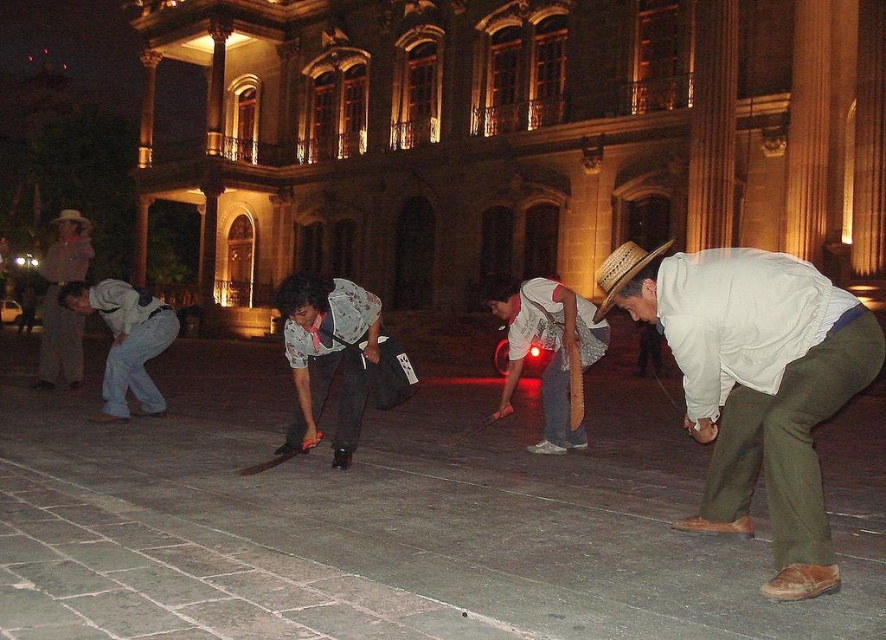
Question: Which of the following is the farthest from the observer?

Choices:
 (A) (88, 307)
 (B) (63, 273)
 (C) (743, 467)

Answer: (B)

Question: Which of the following is the closest to the observer?

Choices:
 (A) (690, 282)
 (B) (118, 305)
 (C) (80, 332)

Answer: (A)

Question: In this image, where is white cotton shirt at lower right located relative to light gray cotton shirt at left?

Choices:
 (A) below
 (B) above

Answer: (A)

Question: Can you confirm if light gray fabric shirt at left is positioned to the left of light gray cotton shirt at left?

Choices:
 (A) no
 (B) yes

Answer: (A)

Question: Among these points, which one is nearest to the camera?

Choices:
 (A) (775, 374)
 (B) (79, 282)
 (C) (57, 246)

Answer: (A)

Question: Can you confirm if white cotton shirt at lower right is positioned to the left of light gray fabric shirt at left?

Choices:
 (A) no
 (B) yes

Answer: (A)